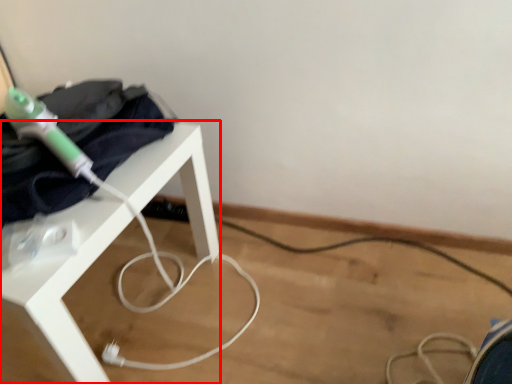
Question: From the image's perspective, where is table (annotated by the red box) located relative to clothing?

Choices:
 (A) above
 (B) below

Answer: (B)